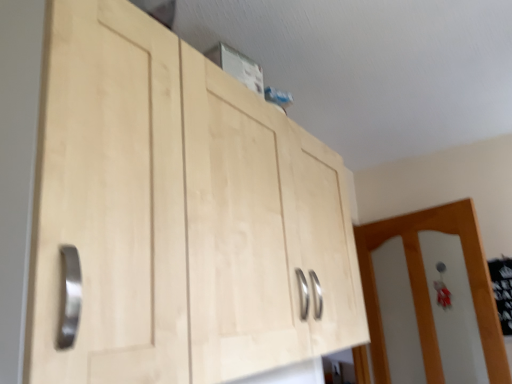
Question: Is natural wood cabinet at upper center taller or shorter than white glossy door at right?

Choices:
 (A) short
 (B) tall

Answer: (A)

Question: Visually, is natural wood cabinet at upper center positioned to the left or to the right of white glossy door at right?

Choices:
 (A) right
 (B) left

Answer: (B)

Question: In terms of width, does natural wood cabinet at upper center look wider or thinner when compared to white glossy door at right?

Choices:
 (A) thin
 (B) wide

Answer: (B)

Question: Considering the positions of white glossy door at right and natural wood cabinet at upper center in the image, is white glossy door at right wider or thinner than natural wood cabinet at upper center?

Choices:
 (A) thin
 (B) wide

Answer: (A)

Question: Considering the relative positions of white glossy door at right and natural wood cabinet at upper center in the image provided, is white glossy door at right to the left or to the right of natural wood cabinet at upper center?

Choices:
 (A) right
 (B) left

Answer: (A)

Question: Is white glossy door at right spatially inside natural wood cabinet at upper center, or outside of it?

Choices:
 (A) outside
 (B) inside

Answer: (A)

Question: In terms of height, does white glossy door at right look taller or shorter compared to natural wood cabinet at upper center?

Choices:
 (A) short
 (B) tall

Answer: (B)